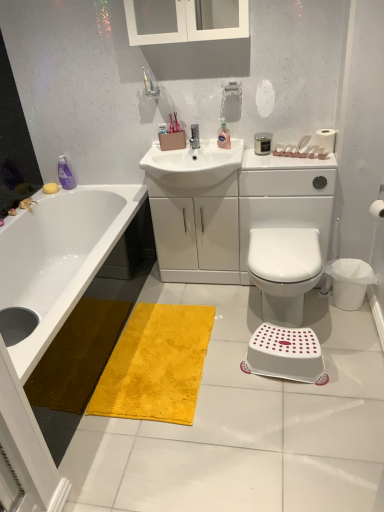
At what (x,y) coordinates should I click in order to perform the action: click on free spot to the right of purple glossy bottle at upper left, which ranks as the first toiletry in left-to-right order. Please return your answer as a coordinate pair (x, y). Looking at the image, I should click on (94, 188).